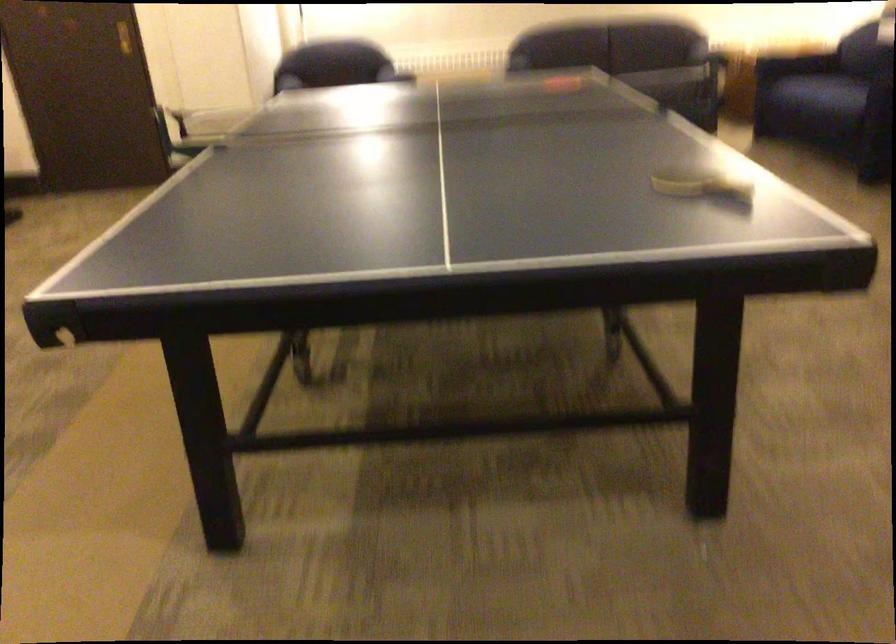
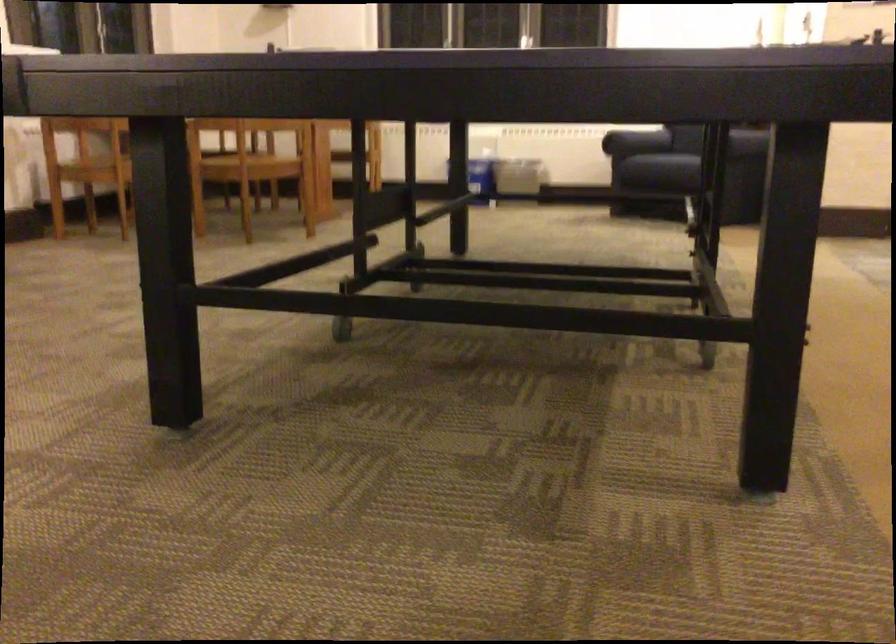
Question: I am providing you with two images of the same scene from different viewpoints. After the viewpoint changes to image2, which objects are now occluded?

Choices:
 (A) ping-pong paddle
 (B) sofa sitting surface
 (C) wire test tube rack
 (D) sofa armrest

Answer: (A)